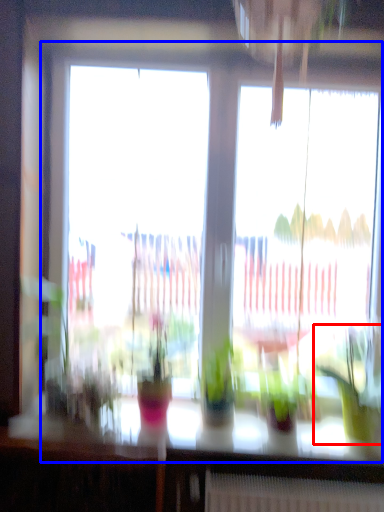
Question: Which point is closer to the camera, houseplant (highlighted by a red box) or window (highlighted by a blue box)?

Choices:
 (A) houseplant
 (B) window

Answer: (A)